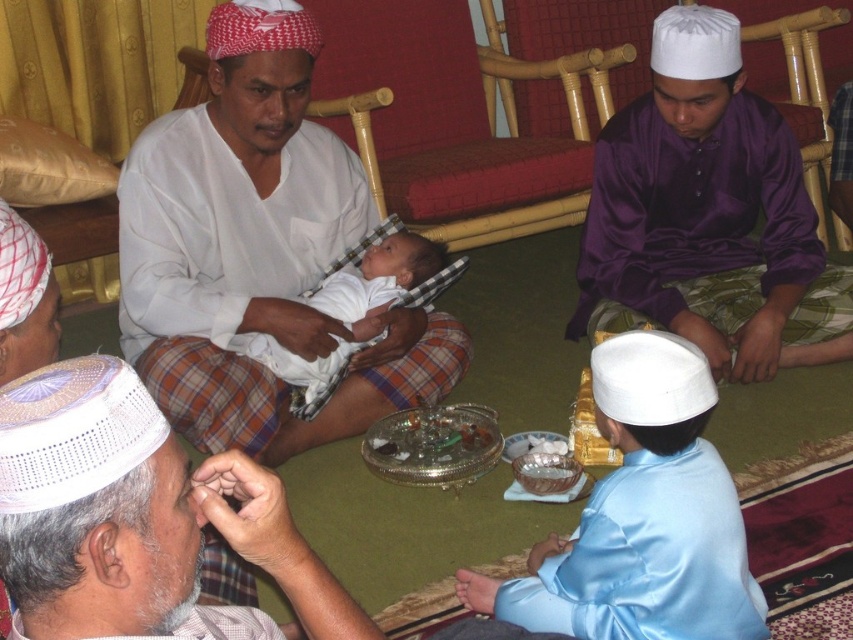
Find the location of `purple satin shirt at center`. purple satin shirt at center is located at coordinates (709, 214).

Between purple satin shirt at center and light blue satin robe at lower right, which one appears on the left side from the viewer's perspective?

Positioned to the left is light blue satin robe at lower right.

Who is more forward, (723, 253) or (585, 516)?

Positioned in front is point (585, 516).

Locate an element on the screen. This screenshot has width=853, height=640. purple satin shirt at center is located at coordinates (709, 214).

Does white woven cap at lower left appear under white cloth baby at center?

Indeed, white woven cap at lower left is positioned under white cloth baby at center.

Does point (260, 468) come closer to viewer compared to point (323, 301)?

That is True.

The height and width of the screenshot is (640, 853). I want to click on white woven cap at lower left, so click(148, 508).

Is white matte shirt at center bigger than purple satin shirt at center?

Indeed, white matte shirt at center has a larger size compared to purple satin shirt at center.

Is white matte shirt at center shorter than purple satin shirt at center?

No.

At what (x,y) coordinates should I click in order to perform the action: click on white matte shirt at center. Please return your answer as a coordinate pair (x, y). Looking at the image, I should click on (256, 252).

At what (x,y) coordinates should I click in order to perform the action: click on white matte shirt at center. Please return your answer as a coordinate pair (x, y). This screenshot has height=640, width=853. Looking at the image, I should click on (256, 252).